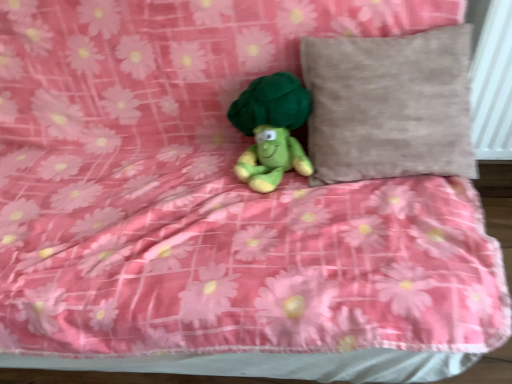
Question: From the image's perspective, is green plush toy at center positioned above or below beige textured pillow at upper right?

Choices:
 (A) above
 (B) below

Answer: (B)

Question: Looking at their shapes, would you say green plush toy at center is wider or thinner than beige textured pillow at upper right?

Choices:
 (A) thin
 (B) wide

Answer: (A)

Question: Is point (304, 168) closer or farther from the camera than point (380, 135)?

Choices:
 (A) farther
 (B) closer

Answer: (A)

Question: Considering their positions, is beige textured pillow at upper right located in front of or behind green plush toy at center?

Choices:
 (A) behind
 (B) front

Answer: (B)

Question: Is point (448, 91) positioned closer to the camera than point (274, 160)?

Choices:
 (A) farther
 (B) closer

Answer: (B)

Question: Considering the positions of beige textured pillow at upper right and green plush toy at center in the image, is beige textured pillow at upper right taller or shorter than green plush toy at center?

Choices:
 (A) short
 (B) tall

Answer: (B)

Question: In terms of size, does beige textured pillow at upper right appear bigger or smaller than green plush toy at center?

Choices:
 (A) big
 (B) small

Answer: (A)